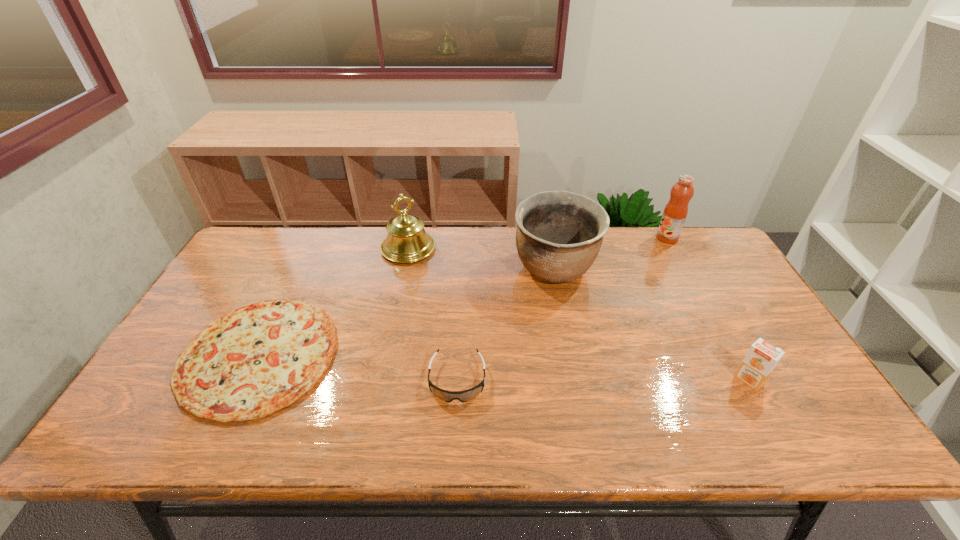
Locate an element on the screen. This screenshot has height=540, width=960. fruit juice positioned at the right edge is located at coordinates (675, 212).

Image resolution: width=960 pixels, height=540 pixels. What are the coordinates of `orange juice located in the right edge section of the desktop` in the screenshot? It's located at (761, 359).

You are a GUI agent. You are given a task and a screenshot of the screen. Output one action in this format:
    pyautogui.click(x=<x>, y=<y>)
    Task: Click on the object at the near left corner
    Image resolution: width=960 pixels, height=540 pixels.
    Given the screenshot: What is the action you would take?
    pyautogui.click(x=255, y=360)

Locate an element on the screen. object that is at the far right corner is located at coordinates (675, 212).

The image size is (960, 540). In order to click on blank space at the far edge of the desktop in this screenshot , I will do `click(458, 246)`.

Where is `vacant area at the near edge of the desktop`? This screenshot has height=540, width=960. vacant area at the near edge of the desktop is located at coordinates (703, 414).

Identify the location of vacant region at the left edge of the desktop. (157, 379).

Locate an element on the screen. This screenshot has width=960, height=540. vacant area at the right edge is located at coordinates (743, 348).

This screenshot has width=960, height=540. In order to click on vacant space at the far left corner of the desktop in this screenshot , I will do `click(255, 267)`.

Where is `free location at the far right corner of the desktop`? The image size is (960, 540). free location at the far right corner of the desktop is located at coordinates (723, 256).